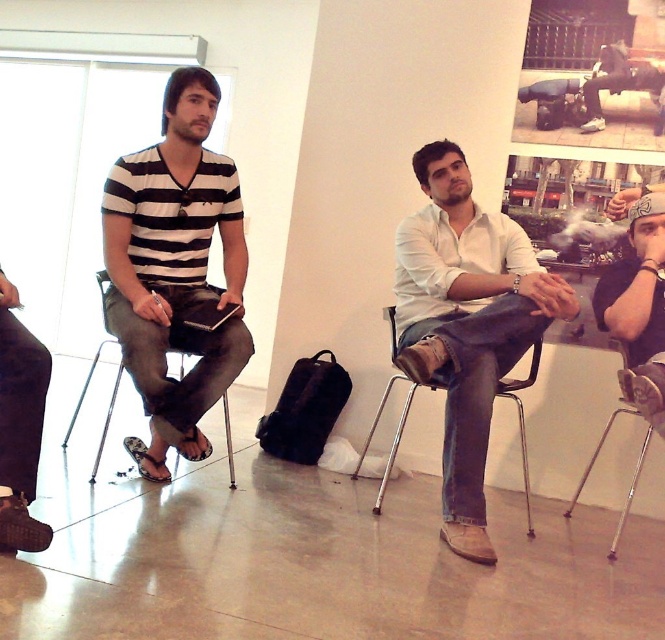
Question: Can you confirm if black matte shirt at upper right is positioned to the right of metallic silver chair at center?

Choices:
 (A) no
 (B) yes

Answer: (B)

Question: Does white matte shirt at center have a smaller size compared to metallic silver chair at left?

Choices:
 (A) no
 (B) yes

Answer: (A)

Question: Based on their relative distances, which object is nearer to the black matte shirt at upper right?

Choices:
 (A) dark brown leather shoes at lower left
 (B) striped cotton shirt at left

Answer: (B)

Question: Which point appears closest to the camera in this image?

Choices:
 (A) (497, 298)
 (B) (636, 396)

Answer: (B)

Question: Does metallic silver chair at left come in front of metallic silver chair at lower right?

Choices:
 (A) yes
 (B) no

Answer: (A)

Question: Which object appears closest to the camera in this image?

Choices:
 (A) black matte shirt at upper right
 (B) striped cotton shirt at left
 (C) dark brown leather shoes at lower left

Answer: (C)